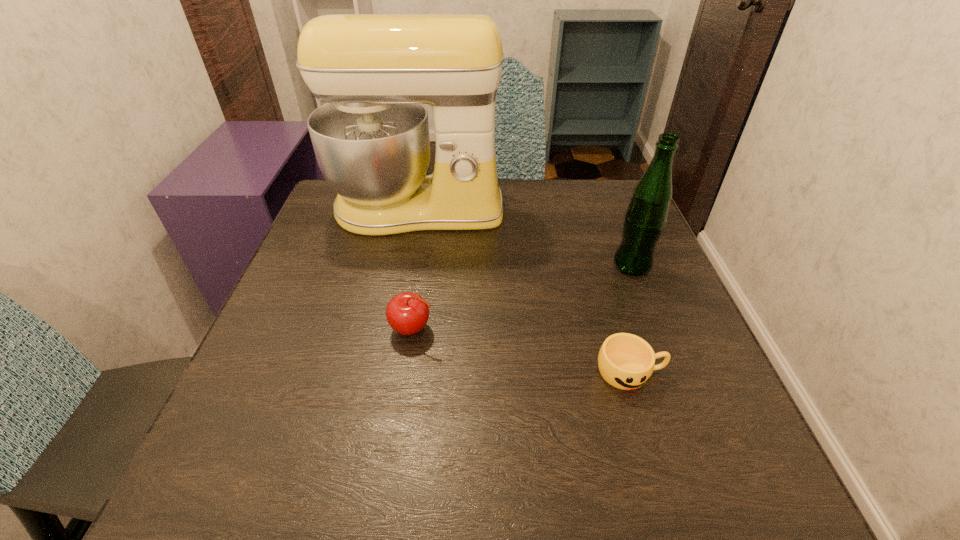
The height and width of the screenshot is (540, 960). In the image, there is a desktop. Find the location of `vacant space at the right edge`. vacant space at the right edge is located at coordinates (594, 237).

The image size is (960, 540). I want to click on free space at the near left corner of the desktop, so point(306,453).

I want to click on empty location between the mixer and the nearest object, so click(524, 291).

This screenshot has width=960, height=540. In order to click on vacant area between the mixer and the beer bottle in this screenshot , I will do `click(525, 238)`.

Find the location of a particular element. The height and width of the screenshot is (540, 960). unoccupied area between the shortest object and the tallest object is located at coordinates pos(524,291).

Image resolution: width=960 pixels, height=540 pixels. I want to click on empty location between the beer bottle and the farthest object, so click(525, 238).

What are the coordinates of `vacant space that is in between the third farthest object and the second farthest object` in the screenshot? It's located at (522, 297).

Where is `empty location between the nearest object and the farthest object`? empty location between the nearest object and the farthest object is located at coordinates point(524,291).

Locate an element on the screen. This screenshot has width=960, height=540. empty location between the farthest object and the cup is located at coordinates (524, 291).

Where is `vacant space in between the beer bottle and the cup`? This screenshot has width=960, height=540. vacant space in between the beer bottle and the cup is located at coordinates (631, 319).